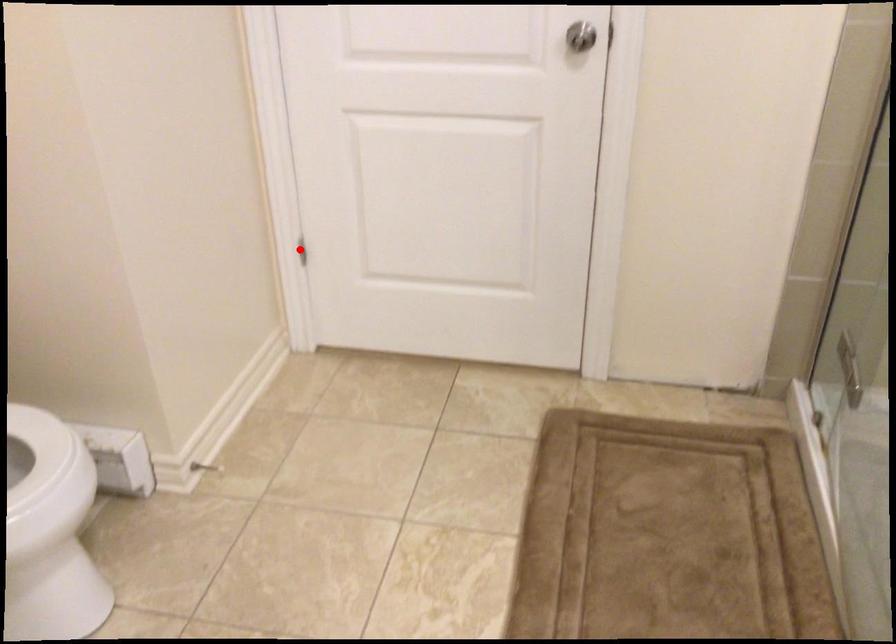
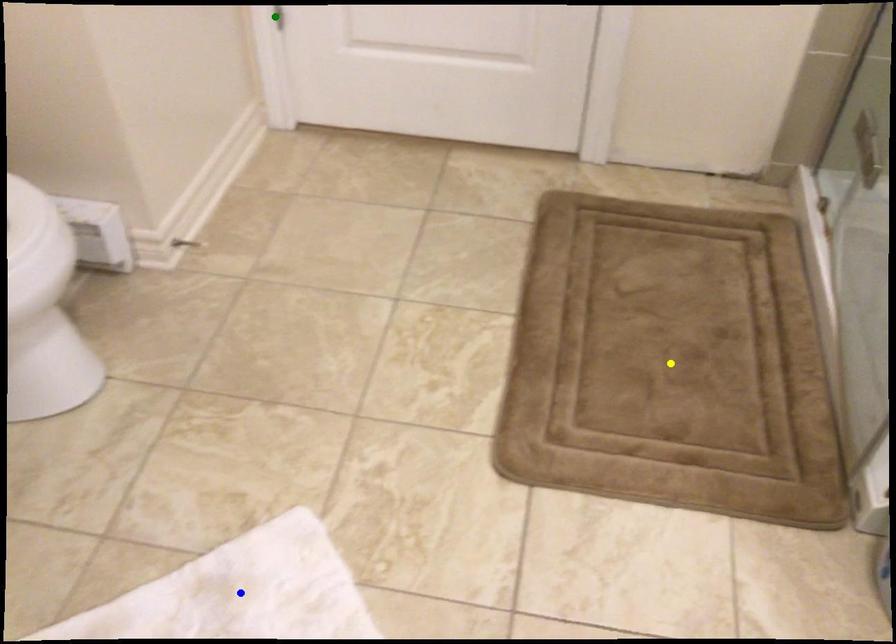
Question: I am providing you with two images of the same scene from different viewpoints. A red point is marked on the first image. You are given multiple points on the second image. In image 2, which mark is for the same physical point as the one in image 1?

Choices:
 (A) blue point
 (B) yellow point
 (C) green point

Answer: (C)